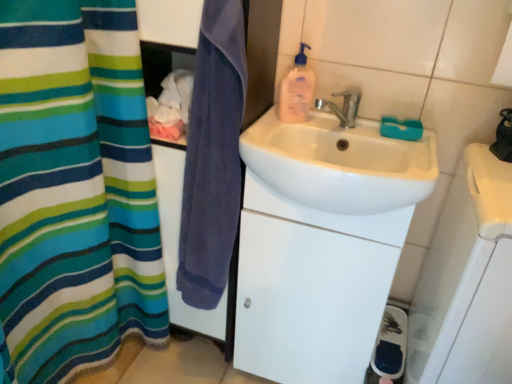
Question: Based on their sizes in the image, would you say white glossy cabinet at center is bigger or smaller than white glossy sink at center?

Choices:
 (A) small
 (B) big

Answer: (B)

Question: Considering the positions of point (370, 231) and point (424, 139), is point (370, 231) closer or farther from the camera than point (424, 139)?

Choices:
 (A) farther
 (B) closer

Answer: (B)

Question: Based on their relative distances, which object is farther from the white glossy sink at center?

Choices:
 (A) metallic silver faucet at upper center
 (B) purple cotton towel at center
 (C) white plastic soap dish at right
 (D) pink translucent liquid soap at upper center
 (E) white glossy cabinet at center

Answer: (C)

Question: Based on their relative distances, which object is farther from the white glossy cabinet at center?

Choices:
 (A) purple cotton towel at center
 (B) metallic silver faucet at upper center
 (C) white glossy sink at center
 (D) white plastic soap dish at right
 (E) pink translucent liquid soap at upper center

Answer: (B)